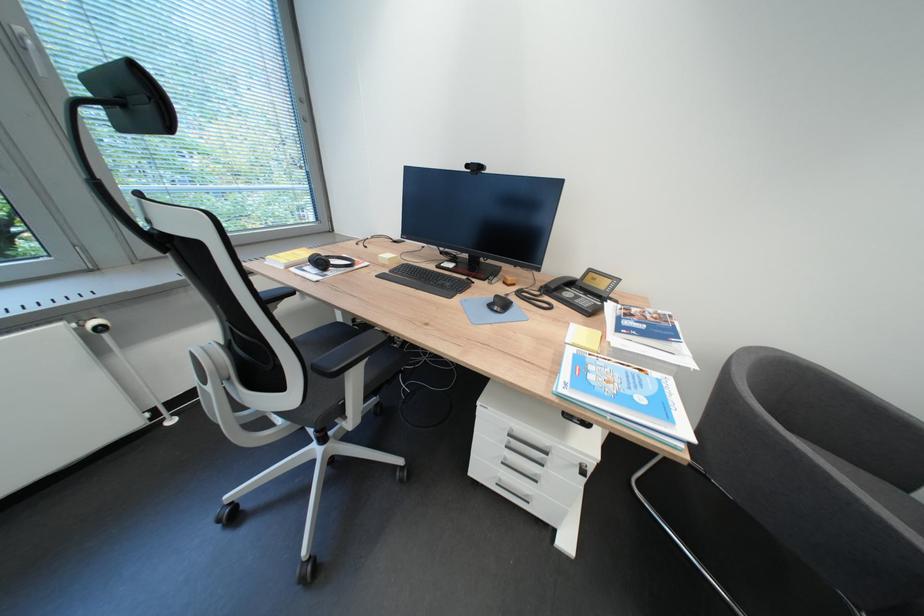
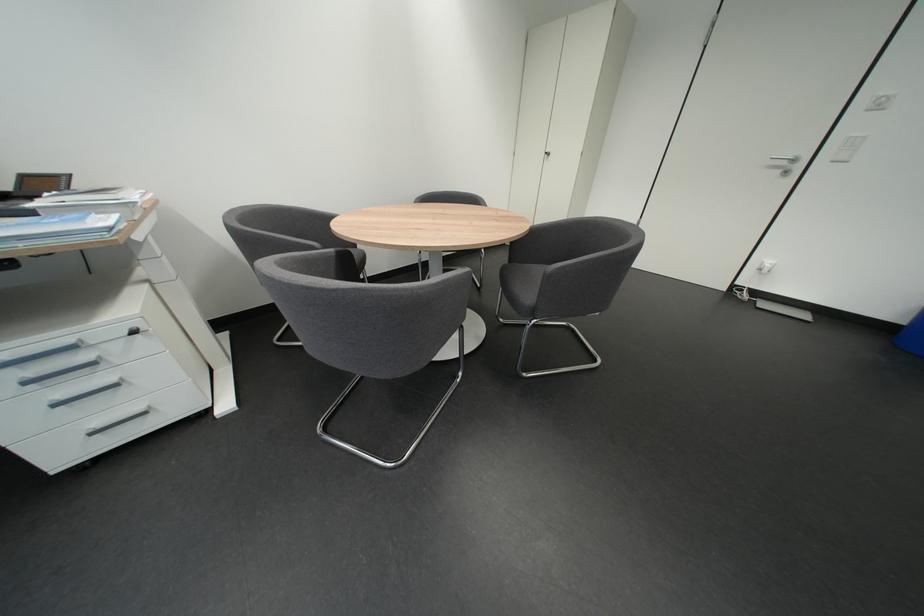
The first image is from the beginning of the video and the second image is from the end. How did the camera likely rotate when shooting the video?

The camera's rotation is toward right-down.